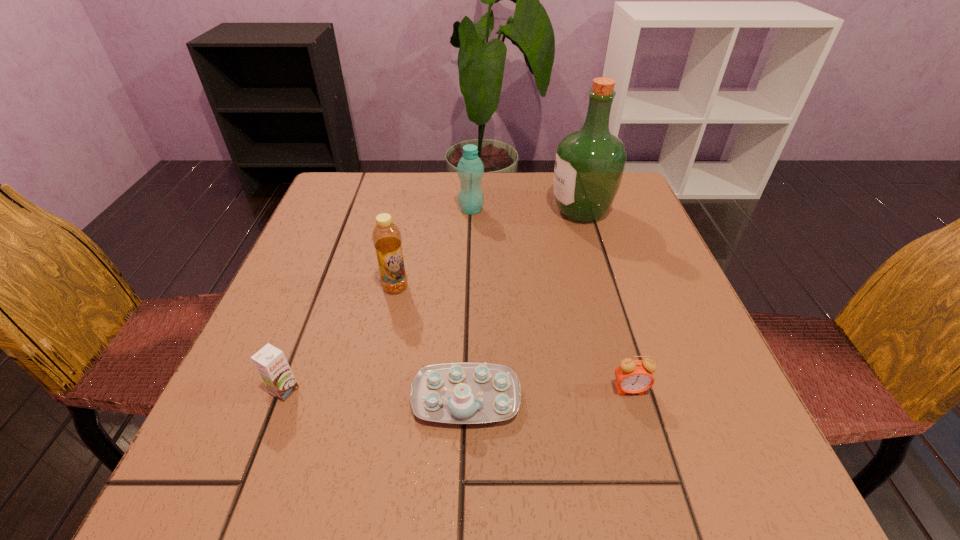
This screenshot has width=960, height=540. Find the location of `free space located 0.070m on the back of the fifth object from right to left`. free space located 0.070m on the back of the fifth object from right to left is located at coordinates (401, 258).

Where is `vacant space located on the front of the right bottle`? The image size is (960, 540). vacant space located on the front of the right bottle is located at coordinates (470, 234).

You are a GUI agent. You are given a task and a screenshot of the screen. Output one action in this format:
    pyautogui.click(x=<x>, y=<y>)
    Task: Click on the blank space located on the right of the chocolate milk
    This screenshot has width=960, height=540.
    Given the screenshot: What is the action you would take?
    pyautogui.click(x=530, y=390)

Where is `vacant space positioned 0.160m on the face of the alarm clock`? The width and height of the screenshot is (960, 540). vacant space positioned 0.160m on the face of the alarm clock is located at coordinates (662, 500).

This screenshot has height=540, width=960. Find the location of `vacant position located on the front of the chinaware`. vacant position located on the front of the chinaware is located at coordinates (464, 491).

The image size is (960, 540). Identify the location of liquor that is at the far edge. (589, 164).

Where is `bottle present at the far edge`? Image resolution: width=960 pixels, height=540 pixels. bottle present at the far edge is located at coordinates (470, 169).

This screenshot has height=540, width=960. What are the coordinates of `object that is positioned at the left edge` in the screenshot? It's located at (270, 362).

Where is `liquor positioned at the right edge`? Image resolution: width=960 pixels, height=540 pixels. liquor positioned at the right edge is located at coordinates (589, 164).

You are a GUI agent. You are given a task and a screenshot of the screen. Output one action in this format:
    pyautogui.click(x=<x>, y=<y>)
    Task: Click on the alarm clock situated at the right edge
    
    Given the screenshot: What is the action you would take?
    pyautogui.click(x=633, y=376)